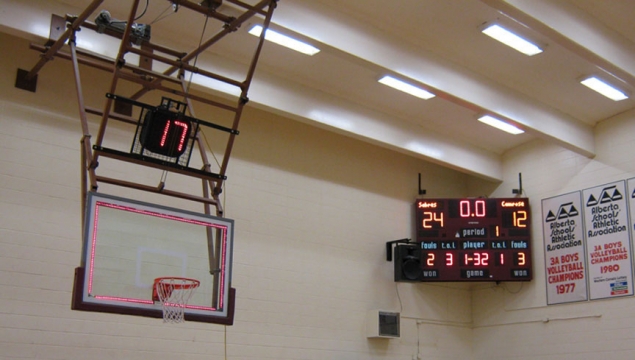
Identify the location of championship banners. The width and height of the screenshot is (635, 360). (564, 222), (613, 210).